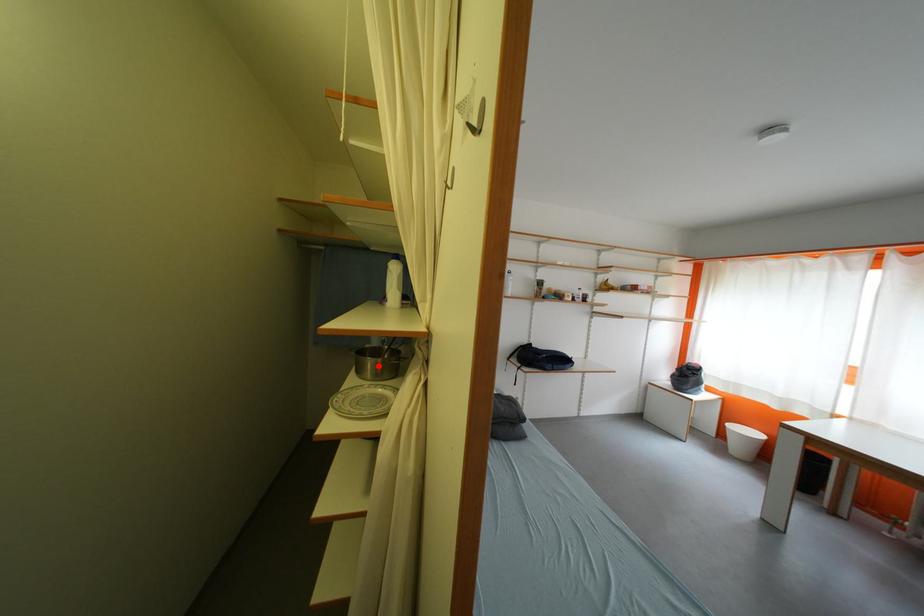
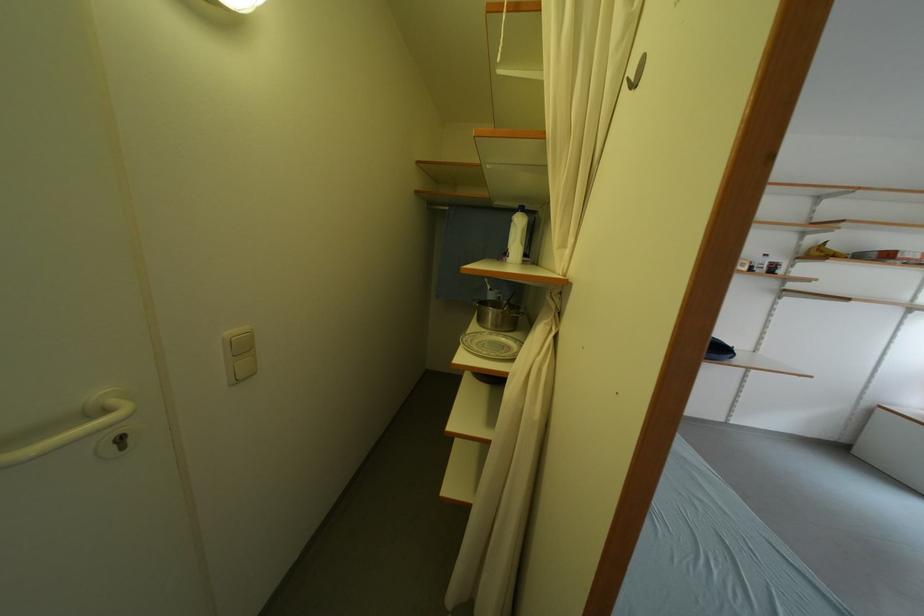
Locate, in the second image, the point that corresponds to the highlighted location in the first image.

(500, 317)